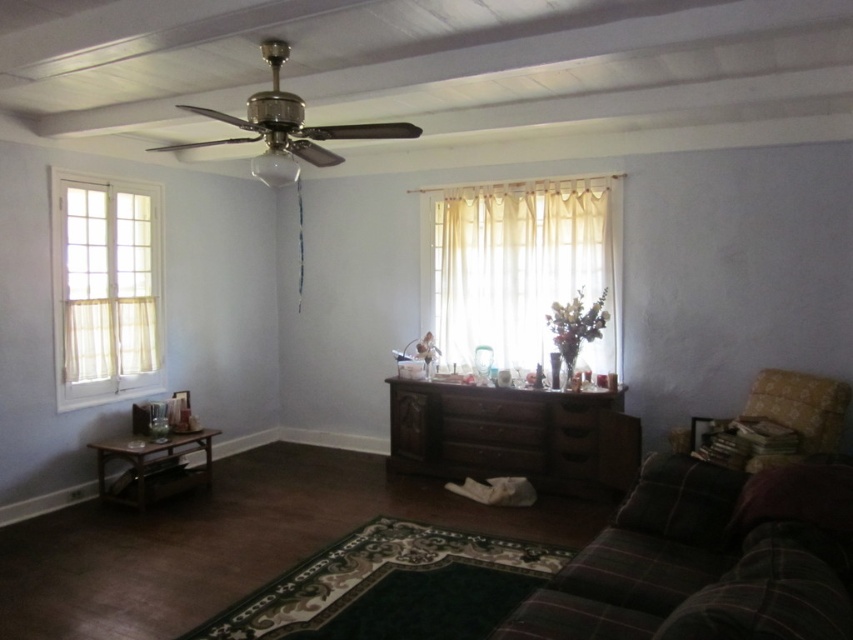
Question: Considering the real-world distances, which object is farthest from the floral-patterned fabric armchair at right?

Choices:
 (A) brown wood drawer at center
 (B) white sheer curtains at left

Answer: (B)

Question: Considering the relative positions of brown wood coffee table at lower left and brown wood drawer at center in the image provided, where is brown wood coffee table at lower left located with respect to brown wood drawer at center?

Choices:
 (A) above
 (B) below

Answer: (B)

Question: Is plaid fabric couch at lower right below floral-patterned fabric armchair at right?

Choices:
 (A) yes
 (B) no

Answer: (A)

Question: Is floral-patterned fabric armchair at right positioned before brown wood drawer at center?

Choices:
 (A) no
 (B) yes

Answer: (B)

Question: Which point is farther to the camera?

Choices:
 (A) (798, 374)
 (B) (825, 557)
 (C) (213, 429)
 (D) (155, 300)

Answer: (C)

Question: Based on their relative distances, which object is farther from the brown wood coffee table at lower left?

Choices:
 (A) white sheer curtains at left
 (B) sheer yellow curtain at center
 (C) dark brown wood dresser at center

Answer: (B)